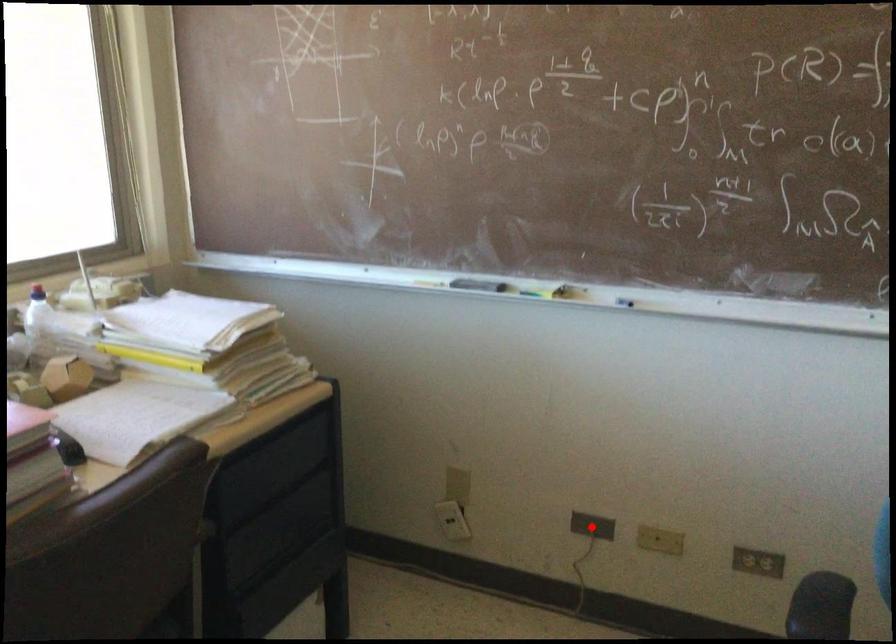
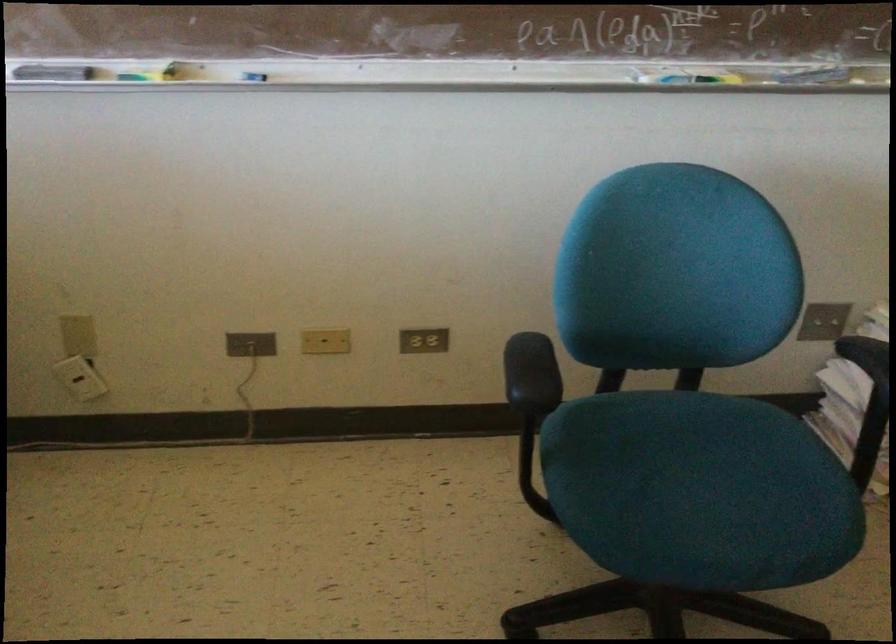
Question: I am providing you with two images of the same scene from different viewpoints. In image1, a red point is highlighted. Considering the same 3D point in image2, which of the following is correct?

Choices:
 (A) It is closer
 (B) It is farther

Answer: (A)